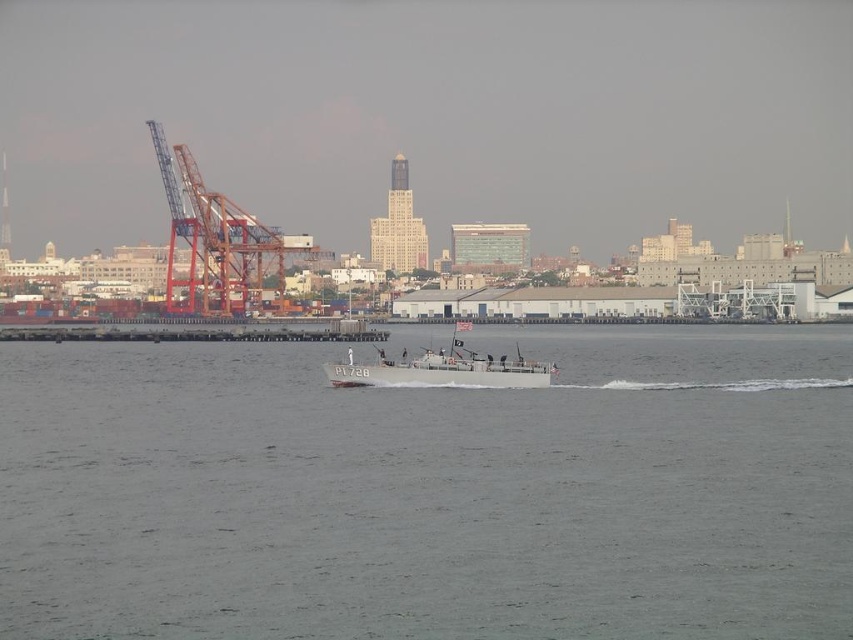
Question: Among these objects, which one is farthest from the camera?

Choices:
 (A) metallic orange crane at left
 (B) gray water at center
 (C) gray metallic boat at center

Answer: (A)

Question: Which point is closer to the camera taking this photo?

Choices:
 (A) (421, 353)
 (B) (625, 600)

Answer: (B)

Question: Is the position of gray water at center less distant than that of metallic orange crane at left?

Choices:
 (A) no
 (B) yes

Answer: (B)

Question: Where is gray water at center located in relation to metallic orange crane at left in the image?

Choices:
 (A) above
 (B) below

Answer: (B)

Question: Can you confirm if gray water at center is bigger than metallic orange crane at left?

Choices:
 (A) yes
 (B) no

Answer: (A)

Question: Which of the following is the closest to the observer?

Choices:
 (A) metallic orange crane at left
 (B) gray water at center
 (C) gray metallic boat at center

Answer: (B)